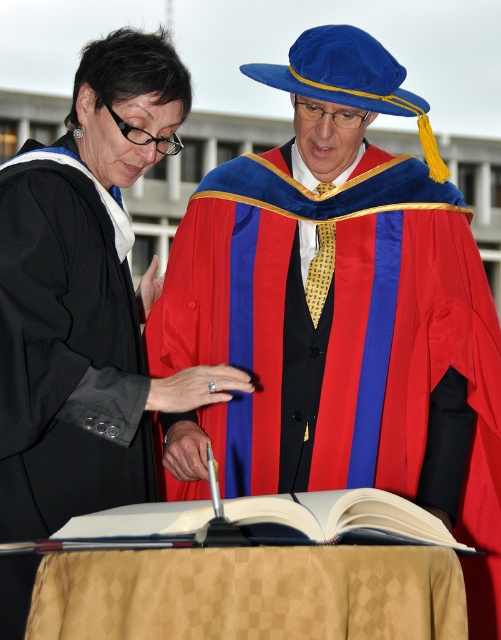
Looking at this image, you are a photographer at a graduation ceremony. You need to capture a photo of the velvet blue graduation gown at center and the matte black robe at left. According to the scene, which one is positioned to the right of the other?

The velvet blue graduation gown at center is positioned on the right side of matte black robe at left.

You are attending a graduation ceremony and need to take a photo of both individuals. The photographer has instructed you to stand at a specific location so that the person at point (320, 177) and the person at point (121, 516) are both visible in the frame. Based on their positions, which direction should you position yourself to ensure both are in the shot?

Since point (320, 177) is behind point (121, 516), you should position yourself in front of point (121, 516) to ensure both individuals are visible in the frame.